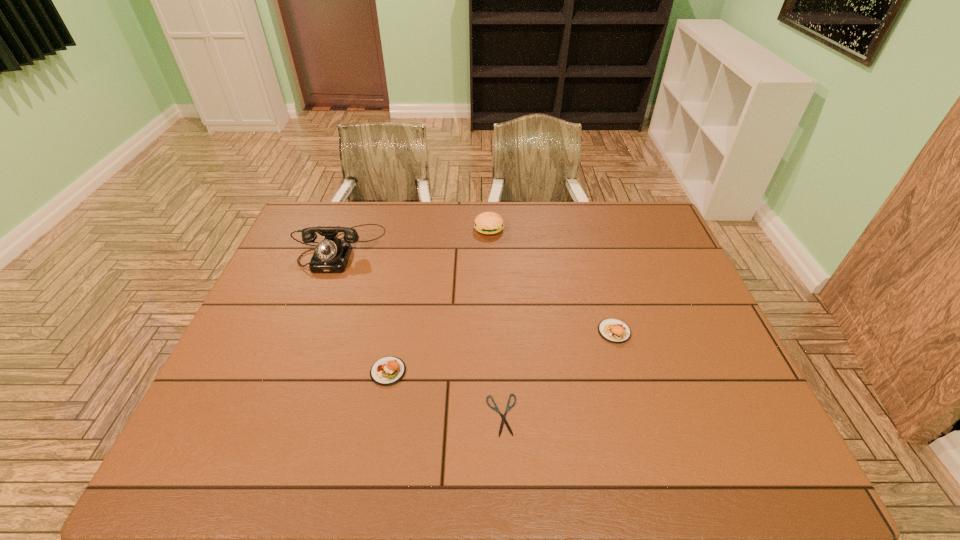
Where is `free space located 0.310m on the front-facing side of the telephone`? free space located 0.310m on the front-facing side of the telephone is located at coordinates (300, 354).

At what (x,y) coordinates should I click in order to perform the action: click on vacant space positioned on the left of the fourth shortest object. Please return your answer as a coordinate pair (x, y). This screenshot has width=960, height=540. Looking at the image, I should click on (435, 228).

Where is `blank area located 0.260m on the back of the third farthest object`? blank area located 0.260m on the back of the third farthest object is located at coordinates (593, 259).

At what (x,y) coordinates should I click in order to perform the action: click on free space located on the left of the fourth farthest object. Please return your answer as a coordinate pair (x, y). Looking at the image, I should click on (296, 372).

This screenshot has width=960, height=540. Find the location of `vacant space situated on the left of the shears`. vacant space situated on the left of the shears is located at coordinates (375, 415).

I want to click on telephone located at the far edge, so click(331, 255).

Find the location of a particular element. The image size is (960, 540). patty at the far edge is located at coordinates (488, 223).

The width and height of the screenshot is (960, 540). Find the location of `object that is at the left edge`. object that is at the left edge is located at coordinates (331, 255).

Where is `object that is at the far left corner`? The height and width of the screenshot is (540, 960). object that is at the far left corner is located at coordinates (331, 255).

Where is `free space at the far edge of the desktop`? free space at the far edge of the desktop is located at coordinates (530, 221).